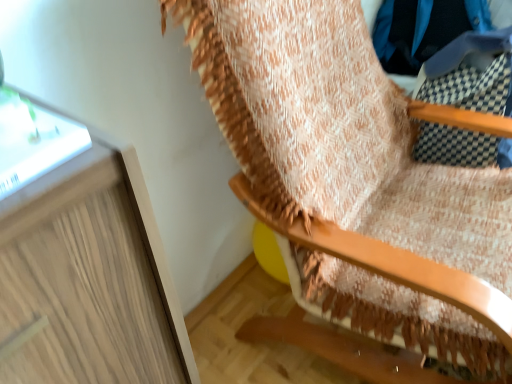
At what (x,y) coordinates should I click in order to perform the action: click on blue fabric at upper right. Please return your answer as a coordinate pair (x, y). Looking at the image, I should click on (423, 29).

This screenshot has width=512, height=384. Describe the element at coordinates (423, 29) in the screenshot. I see `blue fabric at upper right` at that location.

What is the approximate height of wooden rocking chair at upper right?

It is 37.99 inches.

The width and height of the screenshot is (512, 384). What do you see at coordinates (338, 132) in the screenshot?
I see `wooden rocking chair at upper right` at bounding box center [338, 132].

Where is `wooden rocking chair at upper right`? wooden rocking chair at upper right is located at coordinates (338, 132).

Measure the distance between point [263,159] and camera.

Point [263,159] and camera are 32.20 inches apart from each other.

I want to click on blue fabric at upper right, so click(x=423, y=29).

Which object is positioned more to the right, wooden rocking chair at upper right or blue fabric at upper right?

blue fabric at upper right.

From the picture: Which object is more forward, wooden rocking chair at upper right or blue fabric at upper right?

wooden rocking chair at upper right is more forward.

Is point (322, 72) positioned behind point (407, 7)?

That is False.

From the image's perspective, which one is positioned higher, wooden rocking chair at upper right or blue fabric at upper right?

blue fabric at upper right is shown above in the image.

From a real-world perspective, which object rests below the other?

In real-world perspective, wooden rocking chair at upper right is lower.

Which object is wider, wooden rocking chair at upper right or blue fabric at upper right?

Wider between the two is wooden rocking chair at upper right.

Considering the relative sizes of wooden rocking chair at upper right and blue fabric at upper right in the image provided, is wooden rocking chair at upper right shorter than blue fabric at upper right?

Incorrect, the height of wooden rocking chair at upper right does not fall short of that of blue fabric at upper right.

Which of these two, wooden rocking chair at upper right or blue fabric at upper right, is smaller?

With smaller size is blue fabric at upper right.

Consider the image. Can blue fabric at upper right be found inside wooden rocking chair at upper right?

No, wooden rocking chair at upper right does not contain blue fabric at upper right.

Is wooden rocking chair at upper right positioned far away from blue fabric at upper right?

Actually, wooden rocking chair at upper right and blue fabric at upper right are a little close together.

Looking at this image, is wooden rocking chair at upper right oriented towards blue fabric at upper right?

No, wooden rocking chair at upper right is not aimed at blue fabric at upper right.

Can you tell me how much wooden rocking chair at upper right and blue fabric at upper right differ in facing direction?

The facing directions of wooden rocking chair at upper right and blue fabric at upper right are 5.1 degrees apart.

Measure the distance from wooden rocking chair at upper right to blue fabric at upper right.

61.33 centimeters.

Identify the location of clothing on the right of wooden rocking chair at upper right. The image size is (512, 384). (423, 29).

Which object is positioned more to the right, blue fabric at upper right or wooden rocking chair at upper right?

Positioned to the right is blue fabric at upper right.

Relative to wooden rocking chair at upper right, is blue fabric at upper right in front or behind?

blue fabric at upper right is positioned farther from the viewer than wooden rocking chair at upper right.

Does point (422, 36) come farther from viewer compared to point (450, 316)?

Yes, it is.

From the image's perspective, between blue fabric at upper right and wooden rocking chair at upper right, who is located below?

From the image's view, wooden rocking chair at upper right is below.

From a real-world perspective, which object stands above the other?

In real-world perspective, blue fabric at upper right is above.

Is blue fabric at upper right wider than wooden rocking chair at upper right?

Incorrect, the width of blue fabric at upper right does not surpass that of wooden rocking chair at upper right.

Does blue fabric at upper right have a greater height compared to wooden rocking chair at upper right?

In fact, blue fabric at upper right may be shorter than wooden rocking chair at upper right.

Which of these two, blue fabric at upper right or wooden rocking chair at upper right, is bigger?

With larger size is wooden rocking chair at upper right.

Would you say blue fabric at upper right is inside or outside wooden rocking chair at upper right?

blue fabric at upper right exists outside the volume of wooden rocking chair at upper right.

Would you say blue fabric at upper right is a long distance from wooden rocking chair at upper right?

No, blue fabric at upper right is not far away from wooden rocking chair at upper right.

Is blue fabric at upper right oriented towards wooden rocking chair at upper right?

No, blue fabric at upper right is not facing towards wooden rocking chair at upper right.

Can you tell me how much blue fabric at upper right and wooden rocking chair at upper right differ in facing direction?

The angular difference between blue fabric at upper right and wooden rocking chair at upper right is 5.1 degrees.

Locate an element on the screen. The width and height of the screenshot is (512, 384). clothing that is behind the wooden rocking chair at upper right is located at coordinates (423, 29).

At what (x,y) coordinates should I click in order to perform the action: click on furniture below the blue fabric at upper right (from a real-world perspective). Please return your answer as a coordinate pair (x, y). This screenshot has width=512, height=384. Looking at the image, I should click on (338, 132).

Locate an element on the screen. This screenshot has height=384, width=512. clothing that is above the wooden rocking chair at upper right (from the image's perspective) is located at coordinates (423, 29).